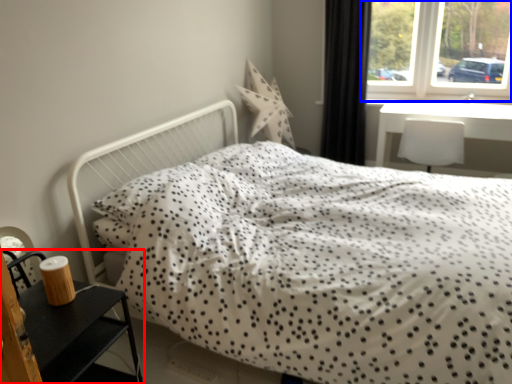
Question: Among these objects, which one is nearest to the camera, nightstand (highlighted by a red box) or window (highlighted by a blue box)?

Choices:
 (A) nightstand
 (B) window

Answer: (A)